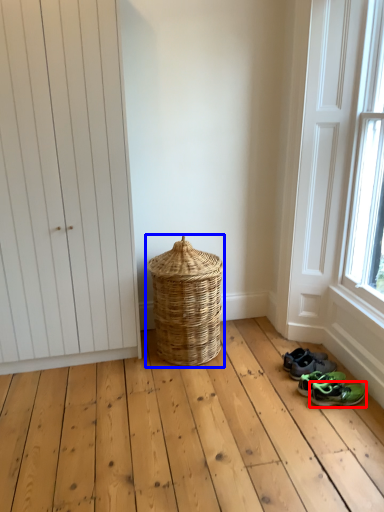
Question: Which object is closer to the camera taking this photo, footwear (highlighted by a red box) or basket (highlighted by a blue box)?

Choices:
 (A) footwear
 (B) basket

Answer: (A)